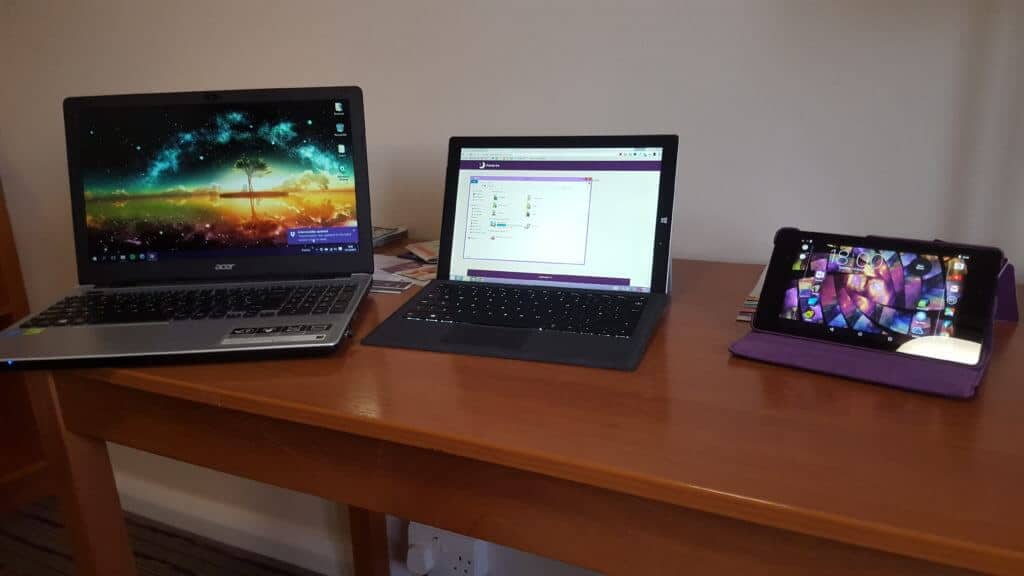
I want to click on tablet stand, so click(x=810, y=362).